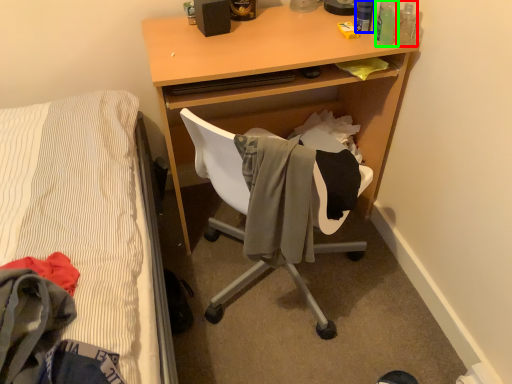
Question: Estimate the real-world distances between objects in this image. Which object is farther from bottle (highlighted by a red box), bottle (highlighted by a blue box) or bottle (highlighted by a green box)?

Choices:
 (A) bottle
 (B) bottle

Answer: (A)